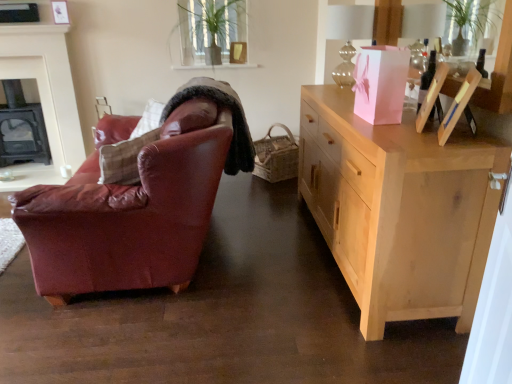
Question: Should I look upward or downward to see black cast iron fireplace at left, the 2th fireplace in the front-to-back sequence?

Choices:
 (A) down
 (B) up

Answer: (B)

Question: From a real-world perspective, is green leafy plant at upper center located higher than natural wood cabinet at right?

Choices:
 (A) no
 (B) yes

Answer: (B)

Question: Is green leafy plant at upper center aimed at natural wood cabinet at right?

Choices:
 (A) yes
 (B) no

Answer: (A)

Question: Is green leafy plant at upper center not inside natural wood cabinet at right?

Choices:
 (A) no
 (B) yes

Answer: (B)

Question: Would you say green leafy plant at upper center is a long distance from natural wood cabinet at right?

Choices:
 (A) no
 (B) yes

Answer: (B)

Question: Is green leafy plant at upper center at the right side of natural wood cabinet at right?

Choices:
 (A) yes
 (B) no

Answer: (B)

Question: From a real-world perspective, does green leafy plant at upper center sit lower than natural wood cabinet at right?

Choices:
 (A) yes
 (B) no

Answer: (B)

Question: Does natural wood cabinet at right have a greater width compared to black cast iron fireplace at left, the 2th fireplace in the front-to-back sequence?

Choices:
 (A) yes
 (B) no

Answer: (A)

Question: Does natural wood cabinet at right have a lesser height compared to black cast iron fireplace at left, the 2th fireplace in the front-to-back sequence?

Choices:
 (A) yes
 (B) no

Answer: (B)

Question: Does natural wood cabinet at right lie behind black cast iron fireplace at left, the 2th fireplace in the front-to-back sequence?

Choices:
 (A) no
 (B) yes

Answer: (A)

Question: Can you confirm if natural wood cabinet at right is taller than black cast iron fireplace at left, the 2th fireplace in the front-to-back sequence?

Choices:
 (A) no
 (B) yes

Answer: (B)

Question: Is natural wood cabinet at right at the left side of black cast iron fireplace at left, marked as the 1th fireplace in a back-to-front arrangement?

Choices:
 (A) no
 (B) yes

Answer: (A)

Question: From the image's perspective, is natural wood cabinet at right over black cast iron fireplace at left, marked as the 1th fireplace in a back-to-front arrangement?

Choices:
 (A) no
 (B) yes

Answer: (A)

Question: Is the depth of green leafy plant at upper center less than that of black cast iron fireplace at left, which is the first fireplace from front to back?

Choices:
 (A) yes
 (B) no

Answer: (A)